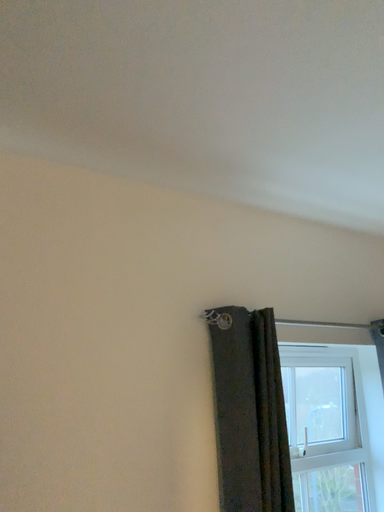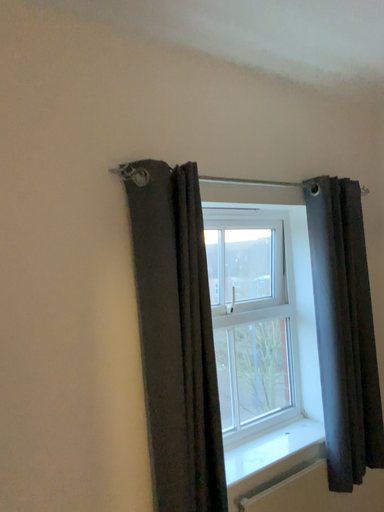
Question: How did the camera likely rotate when shooting the video?

Choices:
 (A) rotated upward
 (B) rotated downward

Answer: (B)